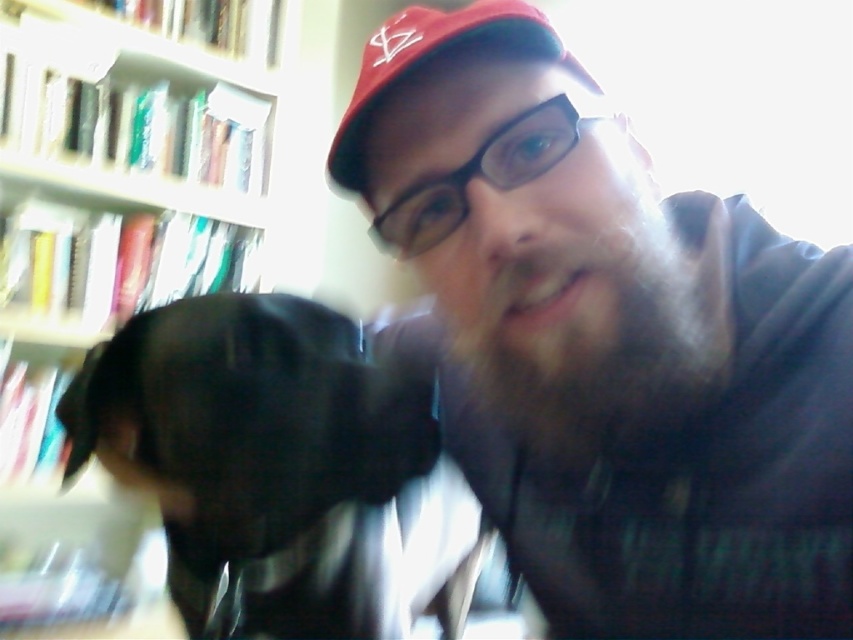
Question: In this image, where is black fur dog at left located relative to matte skin nose at center?

Choices:
 (A) left
 (B) right

Answer: (A)

Question: Observing the image, what is the correct spatial positioning of wooden bookshelf at left in reference to black fur dog at left?

Choices:
 (A) left
 (B) right

Answer: (A)

Question: Among these points, which one is farthest from the camera?

Choices:
 (A) (86, 138)
 (B) (491, 29)
 (C) (209, 381)

Answer: (A)

Question: Is matte black dog at lower left above matte skin nose at center?

Choices:
 (A) yes
 (B) no

Answer: (B)

Question: Which of the following is the farthest from the observer?

Choices:
 (A) (218, 33)
 (B) (497, 339)
 (C) (514, 220)
 (D) (358, 161)

Answer: (A)

Question: Considering the real-world distances, which object is farthest from the wooden bookshelf at left?

Choices:
 (A) red matte baseball cap at upper center
 (B) matte skin nose at center
 (C) matte black dog at lower left
 (D) black fur dog at left

Answer: (B)